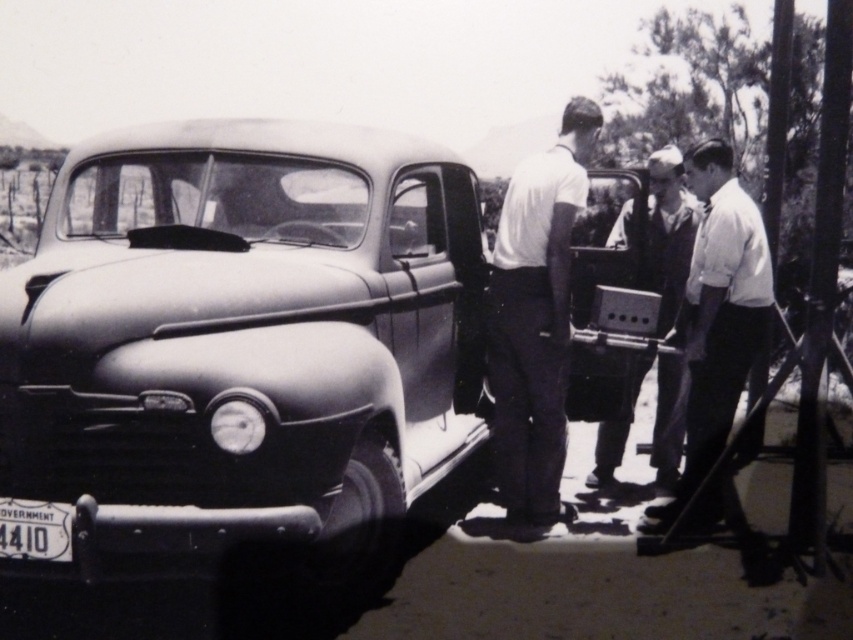
You are standing at the origin point in the image. There is a matte black car at center represented by point (244, 344). Can you see the car from your current position?

Yes, the matte black car at center is represented by point (244, 344), so you can see it from the origin point.

You are a photographer analyzing the composition of this black and white image. The matte black car at center is positioned at a specific coordinate. Can you determine if the car is placed closer to the top or bottom of the image based on its coordinate?

The matte black car at center is located at coordinate point [244,344]. In a standard coordinate system, the y value of 0.287 indicates it is closer to the bottom of the image since lower y values correspond to positions nearer the bottom.

Consider the image. You are a photographer who wants to capture a candid shot of both the white smooth shirt at center and the smooth fabric shirt at center in the scene. Your camera has a maximum focus range of 35 inches. Can you frame both subjects within the same shot without moving the camera?

The distance between the white smooth shirt at center and the smooth fabric shirt at center is 35.59 inches, which exceeds the camera maximum focus range of 35 inches. Therefore, you cannot frame both subjects within the same shot without moving the camera.